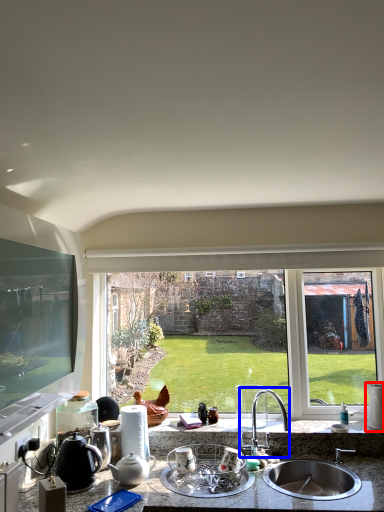
Question: Which of the following is the closest to the observer, appliance (highlighted by a red box) or tap (highlighted by a blue box)?

Choices:
 (A) appliance
 (B) tap

Answer: (B)